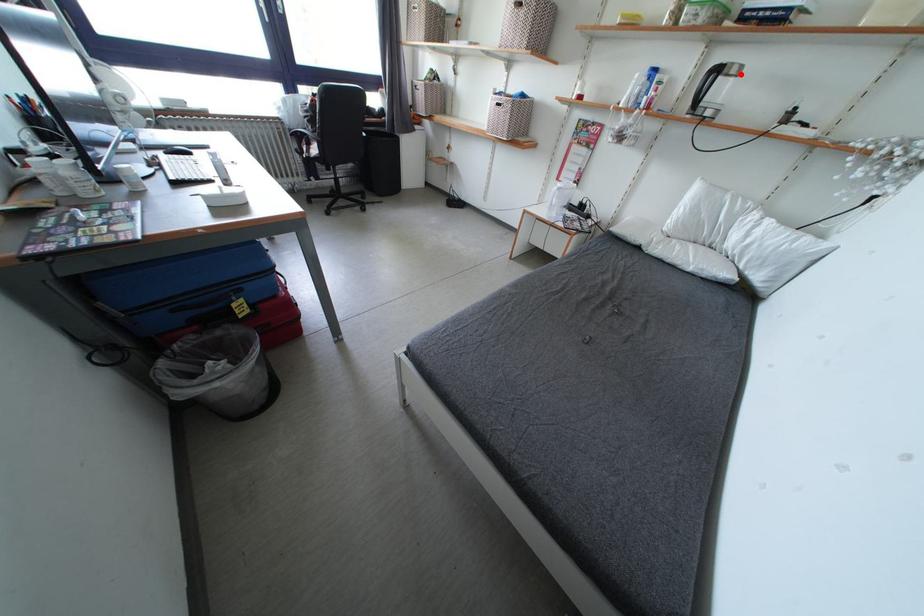
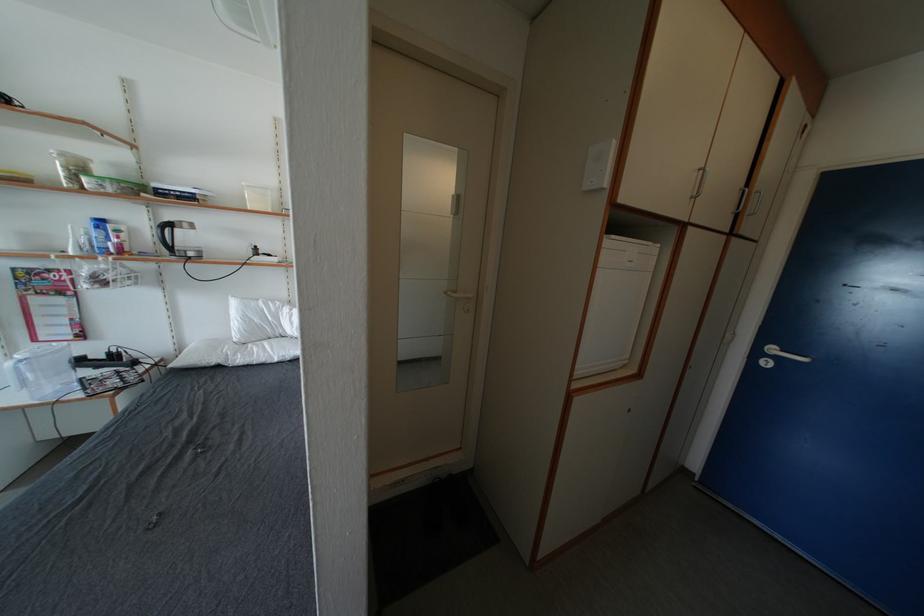
Question: I am providing you with two images of the same scene from different viewpoints. A red point is shown in image1. For the corresponding object point in image2, is it positioned nearer or farther from the camera?

Choices:
 (A) Nearer
 (B) Farther

Answer: (A)